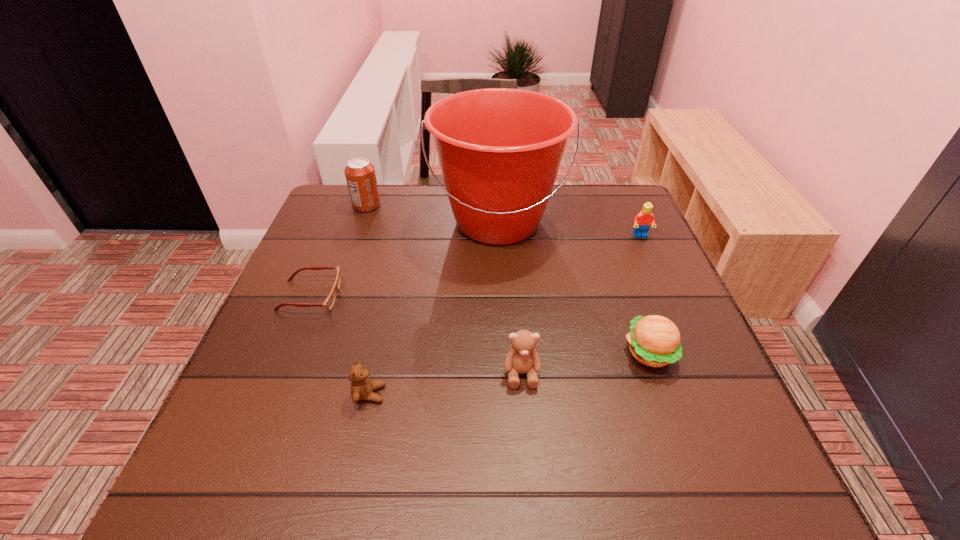
Find the location of a particular element. This screenshot has width=960, height=540. object that is the fourth nearest to the can is located at coordinates (522, 358).

At what (x,y) coordinates should I click in order to perform the action: click on vacant point that satisfies the following two spatial constraints: 1. on the front-facing side of the taller teddy bear; 2. on the front-facing side of the left teddy bear. Please return your answer as a coordinate pair (x, y). Looking at the image, I should click on (523, 394).

This screenshot has width=960, height=540. Find the location of `free location that satisfies the following two spatial constraints: 1. on the front-facing side of the second object from right to left; 2. on the left side of the fourth farthest object`. free location that satisfies the following two spatial constraints: 1. on the front-facing side of the second object from right to left; 2. on the left side of the fourth farthest object is located at coordinates (287, 353).

I want to click on free space that satisfies the following two spatial constraints: 1. on the face of the rightmost object; 2. on the front-facing side of the third object from left to right, so click(710, 394).